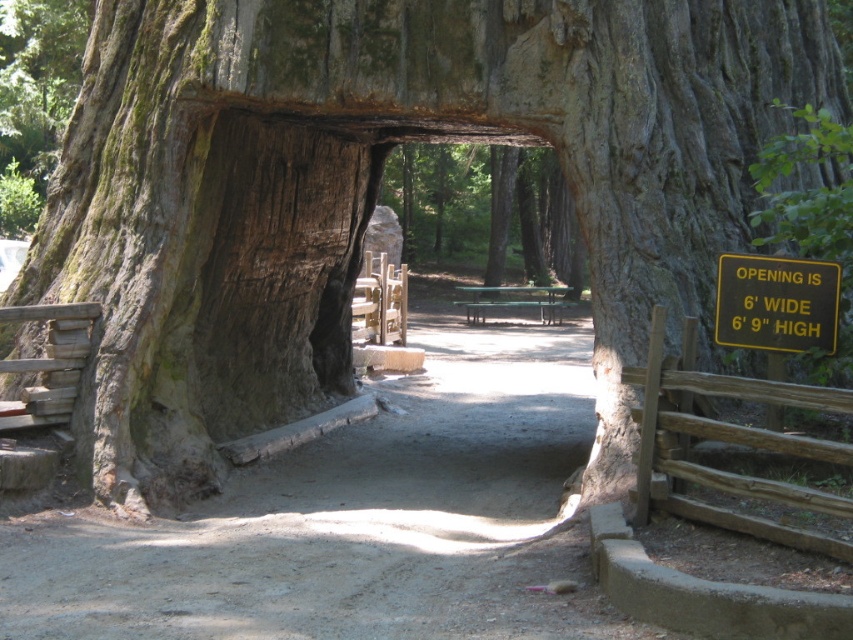
You are a park ranger who needs to place a new sign at the entrance of the tunnel. The sign requires a 60 feet clearance to be visible from both ends. Based on the distance between the dirt path at center and the green wooden bench at center, will the sign fit properly?

The distance between the dirt path at center and the green wooden bench at center is 55.26 feet, which is less than the required 60 feet clearance. Therefore, the sign will not fit properly as there isn not enough space.